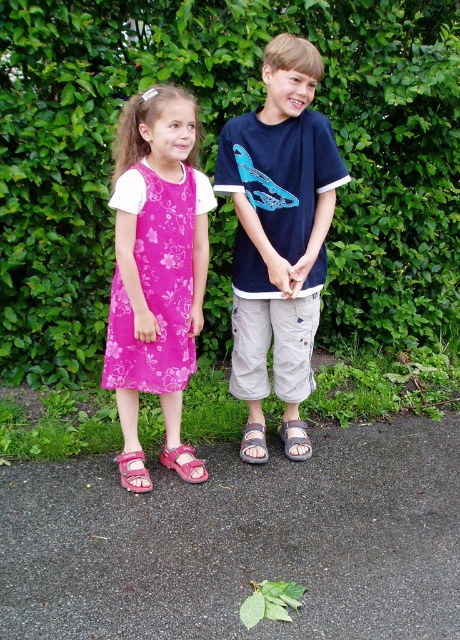
Question: Estimate the real-world distances between objects in this image. Which object is closer to the gray fabric sandal at lower center?

Choices:
 (A) navy blue t-shirt at center
 (B) gray fabric sandal at center
 (C) pink fabric sandal at lower center
 (D) pink fabric sandal at lower left

Answer: (B)

Question: Can you confirm if navy blue t-shirt at center is positioned to the left of gray fabric sandal at lower center?

Choices:
 (A) yes
 (B) no

Answer: (A)

Question: Can you confirm if navy blue t-shirt at center is smaller than gray fabric sandal at lower center?

Choices:
 (A) no
 (B) yes

Answer: (A)

Question: Which point appears closest to the camera in this image?

Choices:
 (A) (258, 428)
 (B) (133, 99)
 (C) (316, 64)
 (D) (172, 465)

Answer: (C)

Question: Can you confirm if navy blue t-shirt at center is bigger than gray fabric sandal at lower center?

Choices:
 (A) no
 (B) yes

Answer: (B)

Question: Estimate the real-world distances between objects in this image. Which object is farther from the pink fabric sandal at lower left?

Choices:
 (A) gray fabric sandal at lower center
 (B) pink floral dress at left
 (C) pink fabric sandal at lower center

Answer: (A)